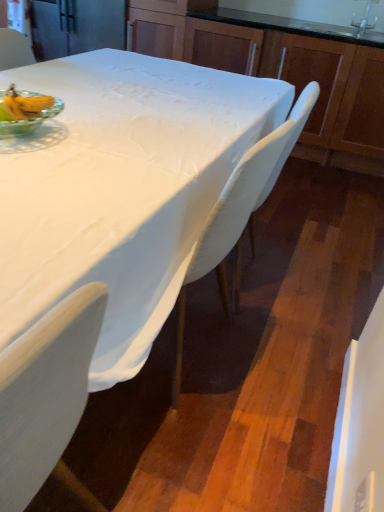
Question: Is white plastic chair at center, the 1th chair in the right-to-left sequence, situated inside green glass bowl at upper left or outside?

Choices:
 (A) inside
 (B) outside

Answer: (B)

Question: Looking at their shapes, would you say white plastic chair at center, the 1th chair from the bottom, is wider or thinner than green glass bowl at upper left?

Choices:
 (A) wide
 (B) thin

Answer: (A)

Question: Estimate the real-world distances between objects in this image. Which object is closer to the wooden cabinets at upper center?

Choices:
 (A) white plastic chair at upper left, the 2th chair from the front
 (B) satin nickel faucet at upper right
 (C) white fabric-covered table at center
 (D) white plastic chair at center, which is the first chair in front-to-back order
 (E) green glass bowl at upper left

Answer: (B)

Question: Which of these objects is positioned farthest from the green glass bowl at upper left?

Choices:
 (A) white plastic chair at center, which is the 2th chair from back to front
 (B) wooden cabinets at upper center
 (C) white fabric-covered table at center
 (D) white plastic chair at upper left, the 1th chair viewed from the back
 (E) satin nickel faucet at upper right

Answer: (E)